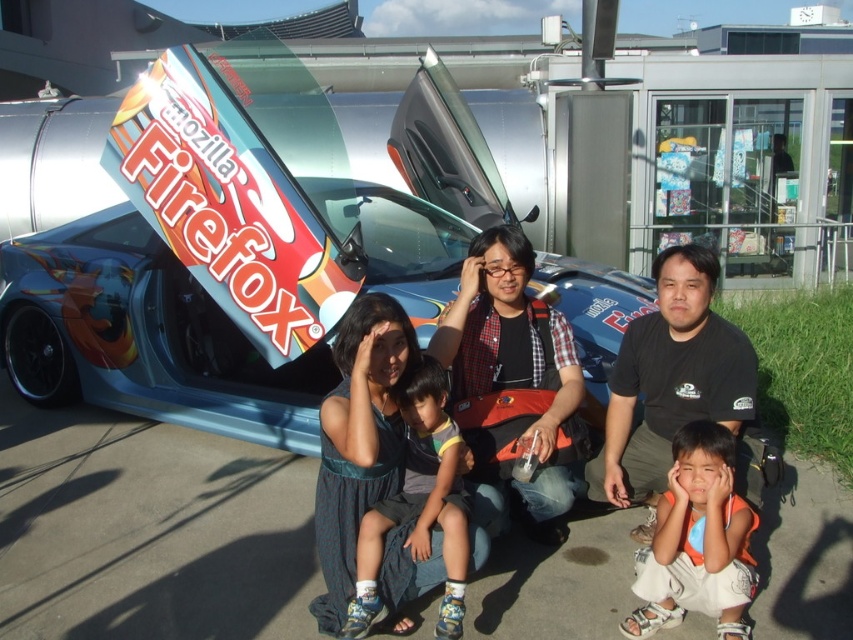
You are standing in front of the car and see the point at coordinates (x=670, y=381). What object is located at that point?

The point at coordinates (x=670, y=381) corresponds to the black cotton shirt at center.